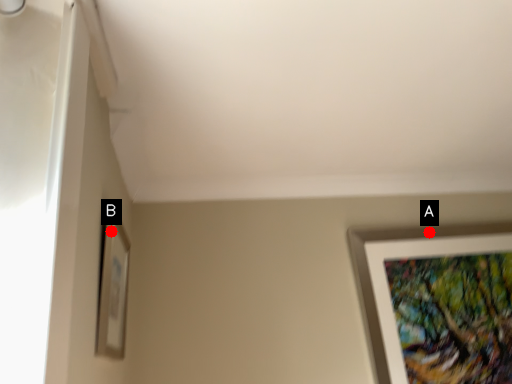
Question: Two points are circled on the image, labeled by A and B beside each circle. Which of the following is the closest to the observer?

Choices:
 (A) A is closer
 (B) B is closer

Answer: (B)